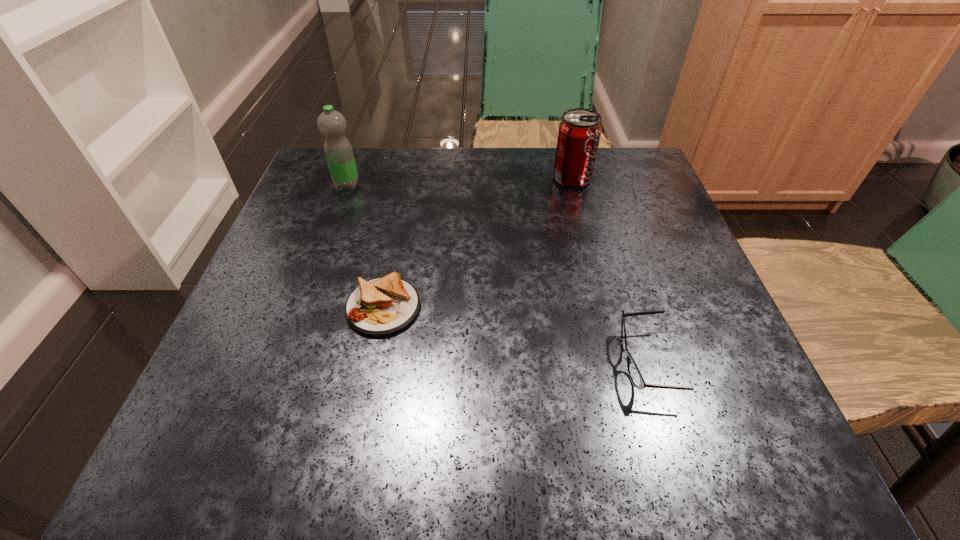
Find the location of a particular element. This screenshot has height=540, width=960. vacant area at the near edge of the desktop is located at coordinates (395, 427).

In the image, there is a desktop. Where is `vacant space at the left edge`? The width and height of the screenshot is (960, 540). vacant space at the left edge is located at coordinates (284, 354).

In the image, there is a desktop. Identify the location of vacant space at the right edge. This screenshot has width=960, height=540. click(x=636, y=275).

Image resolution: width=960 pixels, height=540 pixels. In order to click on free space at the near left corner of the desktop in this screenshot , I will do `click(171, 465)`.

Locate an element on the screen. The height and width of the screenshot is (540, 960). blank space at the far right corner is located at coordinates (650, 194).

At what (x,y) coordinates should I click in order to perform the action: click on vacant space at the near right corner of the desktop. Please return your answer as a coordinate pair (x, y). This screenshot has width=960, height=540. Looking at the image, I should click on (769, 416).

Where is `empty location between the sandwich and the leftmost object`? empty location between the sandwich and the leftmost object is located at coordinates 365,246.

I want to click on free space between the second shortest object and the tallest object, so click(x=496, y=274).

At what (x,y) coordinates should I click in order to perform the action: click on empty space that is in between the spectacles and the tallest object. Please return your answer as a coordinate pair (x, y). This screenshot has width=960, height=540. Looking at the image, I should click on (496, 274).

The height and width of the screenshot is (540, 960). Find the location of `vacant space that is in between the third shortest object and the tallest object`. vacant space that is in between the third shortest object and the tallest object is located at coordinates (460, 181).